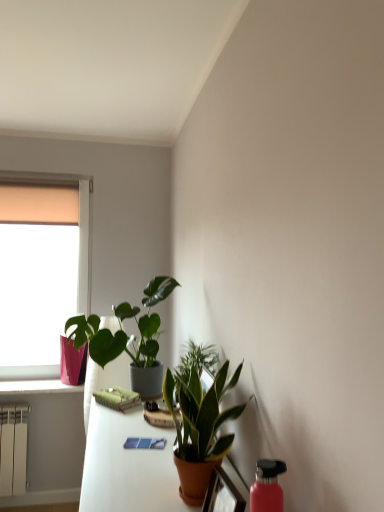
The width and height of the screenshot is (384, 512). Find the location of `pink plastic window sill at left`. pink plastic window sill at left is located at coordinates (37, 387).

What do you see at coordinates (41, 274) in the screenshot? I see `matte pink vase at left` at bounding box center [41, 274].

How much space does green matte plant at upper center, positioned as the 1th houseplant in back-to-front order, occupy vertically?

24.90 inches.

Identify the location of orange fabric curtain at upper left. (39, 204).

Measure the distance between point (x=266, y=476) and camera.

The depth of point (x=266, y=476) is 35.55 inches.

Find the location of `terracotta ceramic table at center`. terracotta ceramic table at center is located at coordinates (128, 466).

Is pink glossy flowerpot at lower left wider or thinner than pink plastic window sill at left?

Considering their sizes, pink glossy flowerpot at lower left looks slimmer than pink plastic window sill at left.

Is pink glossy flowerpot at lower left facing towards pink plastic window sill at left?

No, pink glossy flowerpot at lower left is not turned towards pink plastic window sill at left.

Is pink glossy flowerpot at lower left next to pink plastic window sill at left?

There is a gap between pink glossy flowerpot at lower left and pink plastic window sill at left.

Is pink glossy flowerpot at lower left spatially inside pink plastic window sill at left, or outside of it?

pink glossy flowerpot at lower left exists outside the volume of pink plastic window sill at left.

Which of these two, pink plastic window sill at left or green glossy houseplant at center, positioned as the 1th houseplant in front-to-back order, stands taller?

Standing taller between the two is green glossy houseplant at center, positioned as the 1th houseplant in front-to-back order.

Find the location of a particular element. window sill on the left of green glossy houseplant at center, marked as the 2th houseplant in a back-to-front arrangement is located at coordinates (37, 387).

Are pink plastic window sill at left and green glossy houseplant at center, marked as the 2th houseplant in a back-to-front arrangement, beside each other?

No.

From the image's perspective, which is below, pink plastic window sill at left or green glossy houseplant at center, the 1th houseplant positioned from the right?

From the image's view, pink plastic window sill at left is below.

Does green glossy houseplant at center, positioned as the 1th houseplant in front-to-back order, have a lesser width compared to orange fabric curtain at upper left?

No.

Between green glossy houseplant at center, the second houseplant from the left, and orange fabric curtain at upper left, which one is positioned in front?

green glossy houseplant at center, the second houseplant from the left.

How far apart are green glossy houseplant at center, positioned as the 1th houseplant in front-to-back order, and orange fabric curtain at upper left?

green glossy houseplant at center, positioned as the 1th houseplant in front-to-back order, and orange fabric curtain at upper left are 1.91 meters apart.

Considering the sizes of objects green glossy houseplant at center, the second houseplant from the left, and orange fabric curtain at upper left in the image provided, who is shorter, green glossy houseplant at center, the second houseplant from the left, or orange fabric curtain at upper left?

Standing shorter between the two is orange fabric curtain at upper left.

Which is correct: orange fabric curtain at upper left is inside matte orange pot at lower center, or outside of it?

orange fabric curtain at upper left exists outside the volume of matte orange pot at lower center.

How much distance is there between orange fabric curtain at upper left and matte orange pot at lower center?

They are 2.25 meters apart.

From a real-world perspective, who is located lower, orange fabric curtain at upper left or matte orange pot at lower center?

From a 3D spatial view, matte orange pot at lower center is below.

In the scene shown: What's the angular difference between orange fabric curtain at upper left and matte orange pot at lower center's facing directions?

They differ by 85.7 degrees in their facing directions.

Is pink matte water bottle at lower right inside terracotta ceramic table at center?

Actually, pink matte water bottle at lower right is outside terracotta ceramic table at center.

Would you say terracotta ceramic table at center is to the left or to the right of pink matte water bottle at lower right in the picture?

terracotta ceramic table at center is to the left of pink matte water bottle at lower right.

From a real-world perspective, is terracotta ceramic table at center over pink matte water bottle at lower right?

No, from a real-world perspective, terracotta ceramic table at center is not above pink matte water bottle at lower right.

From a real-world perspective, is green matte plant at upper center, which ranks as the second houseplant in right-to-left order, physically located above or below orange fabric curtain at upper left?

From a real-world perspective, green matte plant at upper center, which ranks as the second houseplant in right-to-left order, is physically below orange fabric curtain at upper left.

Which of these two, green matte plant at upper center, positioned as the 1th houseplant in left-to-right order, or orange fabric curtain at upper left, is bigger?

green matte plant at upper center, positioned as the 1th houseplant in left-to-right order.

Between point (118, 337) and point (12, 189), which one is positioned behind?

The point (12, 189) is farther from the camera.

Does green matte plant at upper center, positioned as the 1th houseplant in left-to-right order, come in front of orange fabric curtain at upper left?

That is True.

Which is more to the left, green matte plant at upper center, which ranks as the second houseplant in right-to-left order, or matte pink vase at left?

matte pink vase at left.

Which is behind, point (94, 345) or point (30, 202)?

Point (30, 202)

Is green matte plant at upper center, which is the 2th houseplant from front to back, located outside matte pink vase at left?

green matte plant at upper center, which is the 2th houseplant from front to back, is positioned outside matte pink vase at left.

From a real-world perspective, is green matte plant at upper center, positioned as the 1th houseplant in left-to-right order, physically located above or below matte pink vase at left?

green matte plant at upper center, positioned as the 1th houseplant in left-to-right order, is situated lower than matte pink vase at left in the real world.

In the image, there is a pink glossy flowerpot at lower left. Where is `window sill below it (from the image's perspective)`? The image size is (384, 512). window sill below it (from the image's perspective) is located at coordinates (37, 387).

Starting from the pink plastic window sill at left, which houseplant is the 2nd one in front? Please provide its 2D coordinates.

[(200, 428)]

When comparing their distances from matte orange pot at lower center, does matte pink vase at left or orange fabric curtain at upper left seem closer?

Based on the image, matte pink vase at left appears to be nearer to matte orange pot at lower center.

From the image, which object appears to be farther from terracotta ceramic table at center, green glossy houseplant at center, positioned as the 1th houseplant in front-to-back order, or matte orange pot at lower center?

matte orange pot at lower center is further to terracotta ceramic table at center.

Estimate the real-world distances between objects in this image. Which object is closer to matte orange pot at lower center, matte pink vase at left or pink matte water bottle at lower right?

pink matte water bottle at lower right lies closer to matte orange pot at lower center than the other object.

Looking at the image, which one is located closer to pink matte water bottle at lower right, green glossy houseplant at center, marked as the 2th houseplant in a back-to-front arrangement, or matte pink vase at left?

The object closer to pink matte water bottle at lower right is green glossy houseplant at center, marked as the 2th houseplant in a back-to-front arrangement.

From the image, which object appears to be nearer to pink plastic window sill at left, matte pink vase at left or pink glossy flowerpot at lower left?

pink glossy flowerpot at lower left is positioned closer to the anchor pink plastic window sill at left.

Looking at the image, which one is located closer to orange fabric curtain at upper left, matte pink vase at left or matte orange pot at lower center?

Among the two, matte pink vase at left is located nearer to orange fabric curtain at upper left.

When comparing their distances from matte orange pot at lower center, does matte pink vase at left or terracotta ceramic table at center seem closer?

The object closer to matte orange pot at lower center is terracotta ceramic table at center.

Which object lies nearer to the anchor point pink matte water bottle at lower right, pink glossy flowerpot at lower left or terracotta ceramic table at center?

Among the two, terracotta ceramic table at center is located nearer to pink matte water bottle at lower right.

This screenshot has height=512, width=384. Find the location of `table between pink matte water bottle at lower right and orange fabric curtain at upper left along the z-axis`. table between pink matte water bottle at lower right and orange fabric curtain at upper left along the z-axis is located at coordinates (128, 466).

In order to click on houseplant between terracotta ceramic table at center and green matte plant at upper center, positioned as the 1th houseplant in back-to-front order, in the front-back direction in this screenshot , I will do `click(200, 428)`.

Where is `flowerpot positioned between green glossy houseplant at center, the 1th houseplant positioned from the right, and matte pink vase at left from near to far`? The height and width of the screenshot is (512, 384). flowerpot positioned between green glossy houseplant at center, the 1th houseplant positioned from the right, and matte pink vase at left from near to far is located at coordinates click(x=72, y=362).

Where is `table between pink matte water bottle at lower right and green matte plant at upper center, which is the 2th houseplant from front to back, from front to back`? table between pink matte water bottle at lower right and green matte plant at upper center, which is the 2th houseplant from front to back, from front to back is located at coordinates (128, 466).